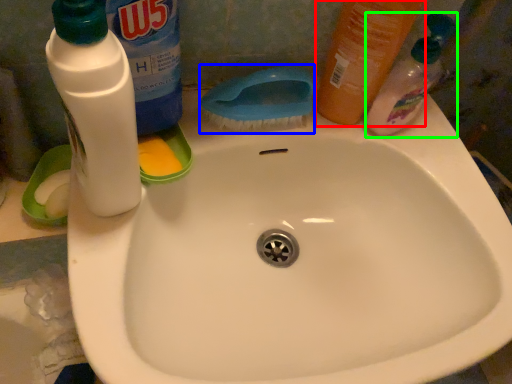
Question: Which is farther away from cleaning product (highlighted by a red box)? brush (highlighted by a blue box) or cleaning product (highlighted by a green box)?

Choices:
 (A) brush
 (B) cleaning product

Answer: (A)